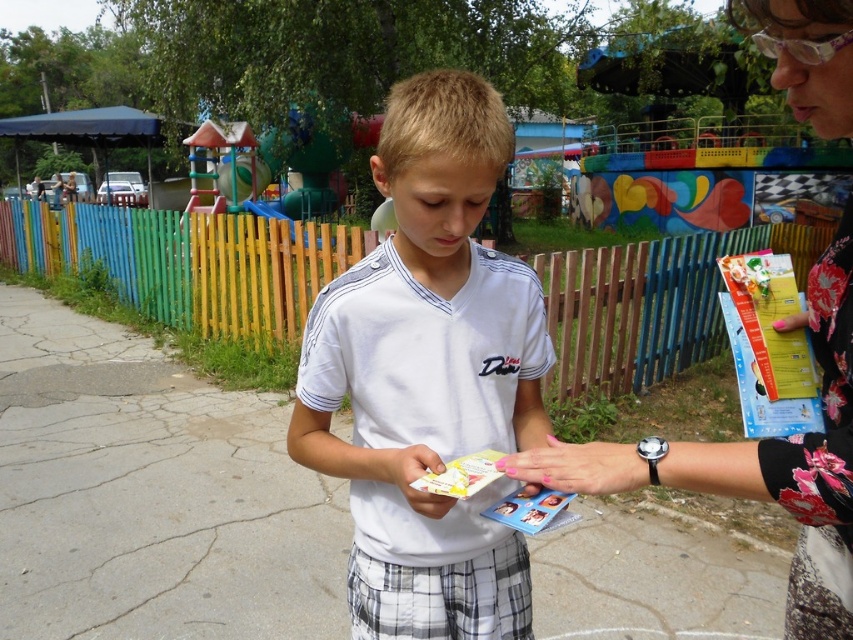
Where is the white cotton shirt at center located in the image?

The white cotton shirt at center is located at point (428, 372) in the image.

You are a photographer trying to capture a clear photo of the multicolored wooden fence at center and the floral fabric wristwatch at center. Which object should you focus on first to avoid obstruction?

The multicolored wooden fence at center is located above the floral fabric wristwatch at center, so you should focus on the multicolored wooden fence at center first to avoid it blocking the view of the wristwatch.

You are standing at the playground and see two points marked in the scene. The first point is at coordinate point (x=792, y=264) and the second is at point (x=392, y=480). Which point is closer to you?

Point (x=792, y=264) is further to the viewer than point (x=392, y=480), so the closer point to you is point (x=392, y=480).